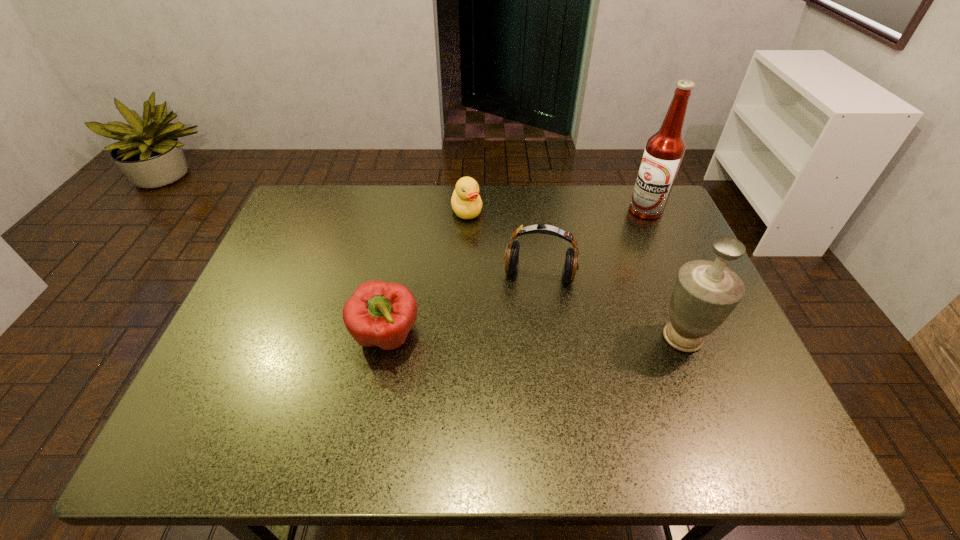
Image resolution: width=960 pixels, height=540 pixels. Identify the location of urn present at the right edge. (705, 293).

This screenshot has height=540, width=960. I want to click on alcohol at the right edge, so click(x=664, y=151).

Image resolution: width=960 pixels, height=540 pixels. Identify the location of object that is at the far right corner. (664, 151).

The image size is (960, 540). What are the coordinates of `vacant space at the far edge of the desktop` in the screenshot? It's located at (525, 194).

Locate an element on the screen. vacant space at the near edge of the desktop is located at coordinates (511, 379).

I want to click on vacant space at the left edge, so click(x=282, y=368).

Image resolution: width=960 pixels, height=540 pixels. Identify the location of free region at the right edge of the desktop. (743, 348).

The image size is (960, 540). I want to click on free location at the near left corner of the desktop, so click(227, 395).

You are a GUI agent. You are given a task and a screenshot of the screen. Output one action in this format:
    pyautogui.click(x=<x>, y=<y>)
    Task: Click on the vacant region at the far right corner
    
    Given the screenshot: What is the action you would take?
    pyautogui.click(x=620, y=202)

Find the location of a particular element. This screenshot has height=540, width=960. vacant region between the bell pepper and the second object from left to right is located at coordinates (427, 274).